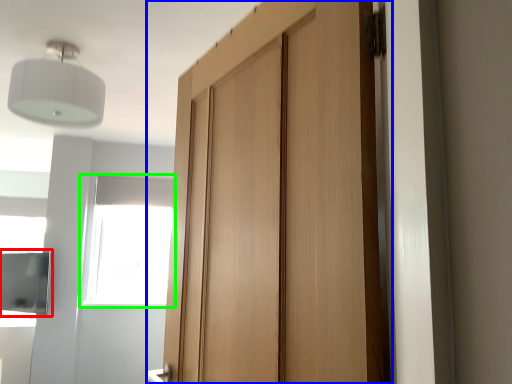
Question: Considering the real-world distances, which object is closest to cabinetry (highlighted by a red box)? door (highlighted by a blue box) or window (highlighted by a green box).

Choices:
 (A) door
 (B) window

Answer: (B)